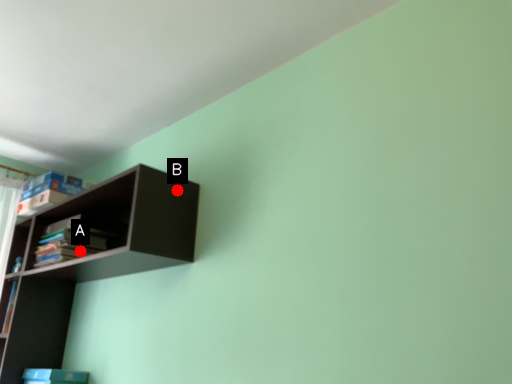
Question: Two points are circled on the image, labeled by A and B beside each circle. Which of the following is the farthest from the observer?

Choices:
 (A) A is further
 (B) B is further

Answer: (A)